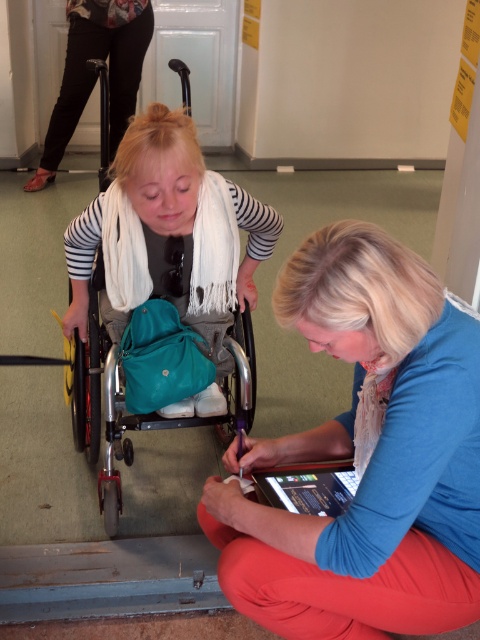
Is blue fabric at lower right to the right of teal fabric wheelchair at center from the viewer's perspective?

Correct, you'll find blue fabric at lower right to the right of teal fabric wheelchair at center.

Based on the photo, who is more forward, (323, 253) or (80, 417)?

Point (323, 253)

Who is more forward, (418, 612) or (121, 420)?

Point (418, 612) is more forward.

At what (x,y) coordinates should I click in order to perform the action: click on blue fabric at lower right. Please return your answer as a coordinate pair (x, y). This screenshot has height=640, width=480. Looking at the image, I should click on (370, 458).